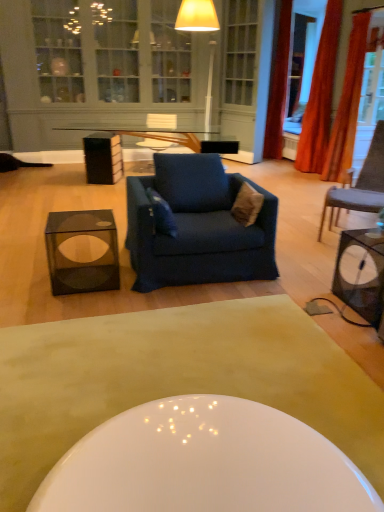
Question: Considering the positions of brown fuzzy pillow at center, which ranks as the 1th pillow in right-to-left order, and metallic black table at right, which is the second table in left-to-right order, in the image, is brown fuzzy pillow at center, which ranks as the 1th pillow in right-to-left order, wider or thinner than metallic black table at right, which is the second table in left-to-right order,?

Choices:
 (A) wide
 (B) thin

Answer: (B)

Question: In the image, is brown fuzzy pillow at center, which ranks as the 1th pillow in right-to-left order, on the left side or the right side of metallic black table at right, placed as the first table when sorted from right to left?

Choices:
 (A) right
 (B) left

Answer: (B)

Question: Based on their relative distances, which object is nearer to the matte glass cabinet at upper center?

Choices:
 (A) metallic black table at right, placed as the first table when sorted from right to left
 (B) orange fabric curtain at upper right, which is the third curtain in front-to-back order
 (C) orange fabric curtain at right, which ranks as the 2th curtain in back-to-front order
 (D) matte black cube at center, acting as the 1th coffee table starting from the top
 (E) dark brown fabric chair at right

Answer: (D)

Question: Which object is the closest to the matte black cube at center, acting as the 1th coffee table starting from the top?

Choices:
 (A) metallic black table at right, placed as the first table when sorted from right to left
 (B) dark blue fabric couch at center
 (C) matte glass cabinet at upper center
 (D) orange fabric curtain at right, arranged as the 2th curtain when viewed from the front
 (E) white glossy coffee table at center, arranged as the first coffee table when ordered from the bottom

Answer: (C)